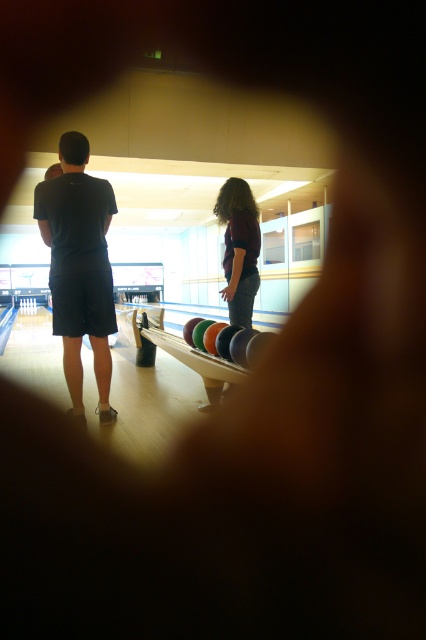
Question: From the image, what is the correct spatial relationship of dark gray shorts at center in relation to maroon fabric shirt at center?

Choices:
 (A) above
 (B) below

Answer: (B)

Question: Considering the relative positions of dark gray shorts at center and maroon fabric shirt at center in the image provided, where is dark gray shorts at center located with respect to maroon fabric shirt at center?

Choices:
 (A) left
 (B) right

Answer: (A)

Question: Is dark gray shorts at center wider than maroon fabric shirt at center?

Choices:
 (A) yes
 (B) no

Answer: (A)